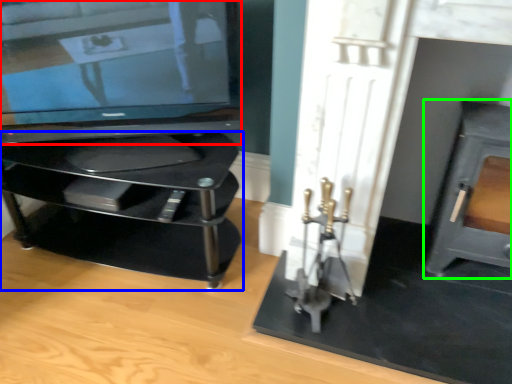
Question: Which object is the closest to the television (highlighted by a red box)? Choose among these: furniture (highlighted by a blue box) or fireplace (highlighted by a green box).

Choices:
 (A) furniture
 (B) fireplace

Answer: (A)